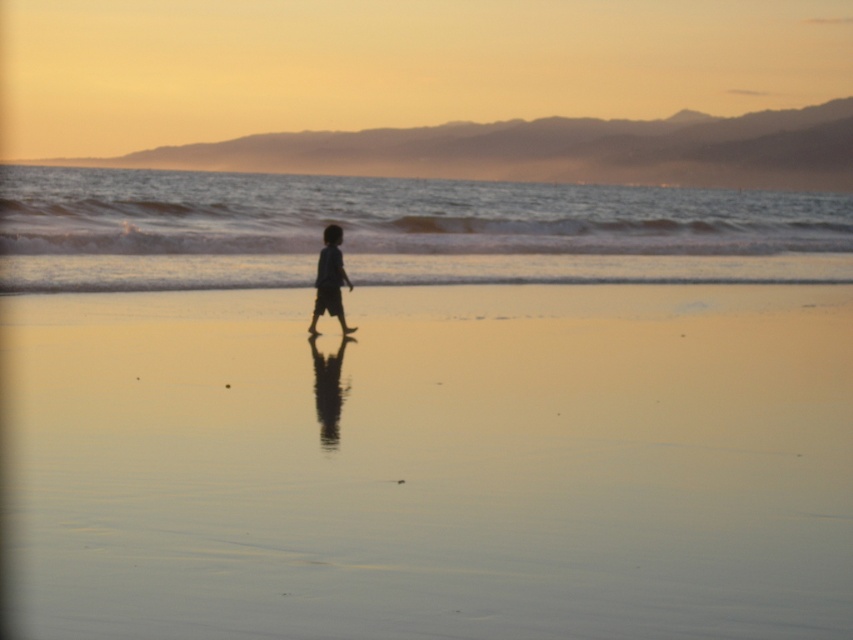
You are standing on the beach and want to place a small flag exactly where the smooth sand at center meets the clear water at center. Based on the scene description, where would you place the flag?

The smooth sand at center is shorter than clear water at center, so you should place the flag where the smooth sand at center ends and the clear water at center begins, which is closer to the land since the sand area is lower than the water area.

You are standing on the beach and see the clear water at center and the silhouette cotton boy at center. Which object is positioned to the left?

The clear water at center is to the left of the silhouette cotton boy at center, so the clear water at center is positioned to the left.

Based on the photo, you are a photographer trying to capture the silhouette cotton boy at center and the smooth sand at center in a single shot. Since the boy is moving towards the water, where should you position yourself relative to the boy to ensure both elements are in frame?

You should position yourself to the left of the silhouette cotton boy at center. This way, the smooth sand at center to the right of the silhouette cotton boy at center will be visible in the frame along with the boy.